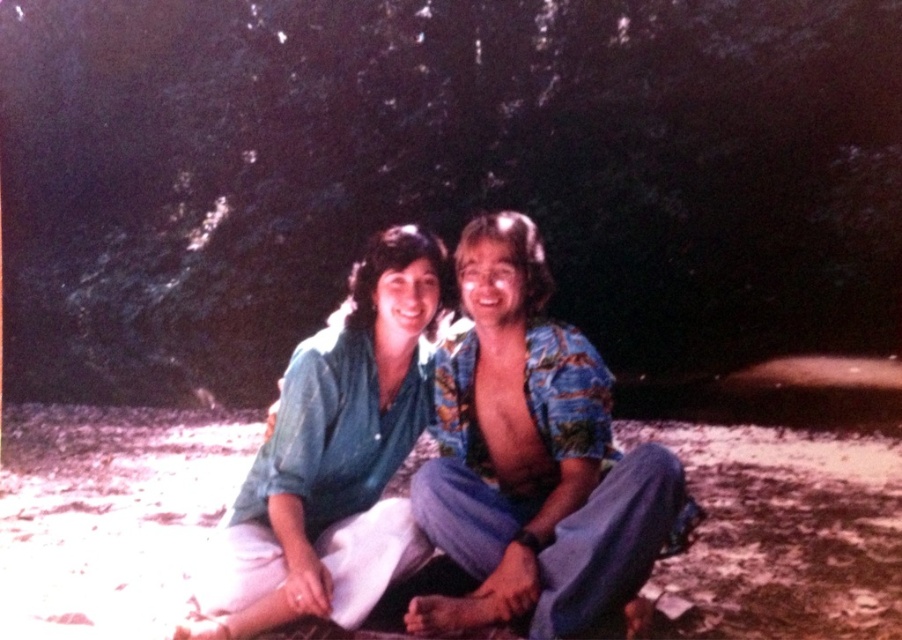
Is point (507, 461) closer to camera compared to point (288, 365)?

Yes, it is in front of point (288, 365).

Between printed fabric shirt at center and matte blue shirt at center, which one appears on the right side from the viewer's perspective?

printed fabric shirt at center

Between point (532, 493) and point (235, 636), which one is positioned in front?

Point (235, 636) is more forward.

At what (x,y) coordinates should I click in order to perform the action: click on printed fabric shirt at center. Please return your answer as a coordinate pair (x, y). This screenshot has width=902, height=640. Looking at the image, I should click on (532, 458).

Is white sandy ground at center to the right of matte blue shirt at center from the viewer's perspective?

Incorrect, white sandy ground at center is not on the right side of matte blue shirt at center.

Which of these two, white sandy ground at center or matte blue shirt at center, stands taller?

Standing taller between the two is matte blue shirt at center.

Image resolution: width=902 pixels, height=640 pixels. I want to click on white sandy ground at center, so [107, 512].

Image resolution: width=902 pixels, height=640 pixels. What are the coordinates of `white sandy ground at center` in the screenshot? It's located at (107, 512).

Which is above, white sandy ground at center or printed fabric shirt at center?

printed fabric shirt at center is above.

Can you confirm if white sandy ground at center is positioned to the right of printed fabric shirt at center?

No, white sandy ground at center is not to the right of printed fabric shirt at center.

Is point (221, 435) positioned behind point (483, 422)?

Yes, it is.

Where is `white sandy ground at center`? white sandy ground at center is located at coordinates (107, 512).